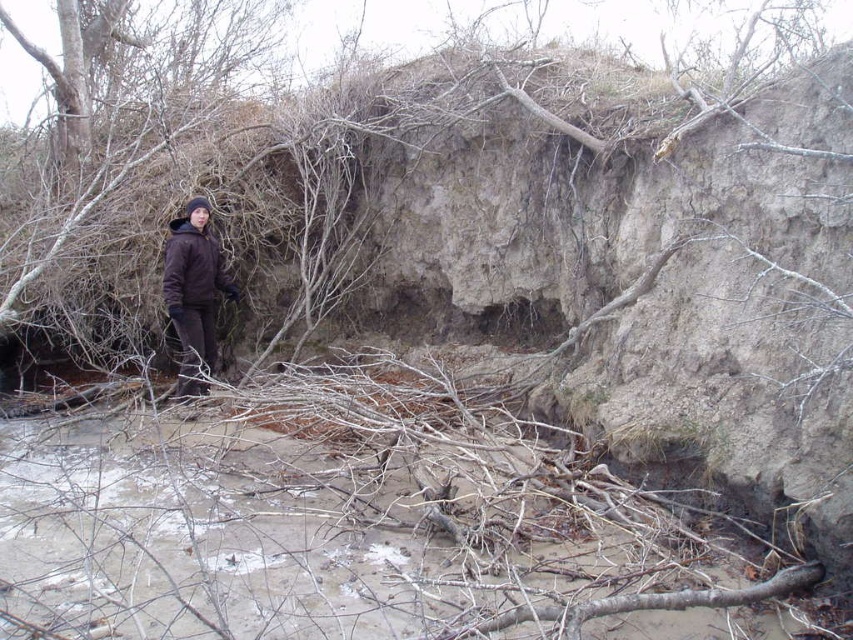
Question: Among these points, which one is farthest from the camera?

Choices:
 (A) (193, 202)
 (B) (210, 234)

Answer: (B)

Question: Is brown soft jacket at left closer to camera compared to brown matte jacket at left?

Choices:
 (A) no
 (B) yes

Answer: (A)

Question: Can you confirm if brown soft jacket at left is bigger than brown matte jacket at left?

Choices:
 (A) yes
 (B) no

Answer: (A)

Question: Observing the image, what is the correct spatial positioning of brown soft jacket at left in reference to brown matte jacket at left?

Choices:
 (A) below
 (B) above

Answer: (A)

Question: Among these points, which one is farthest from the camera?

Choices:
 (A) (216, 282)
 (B) (173, 289)

Answer: (A)